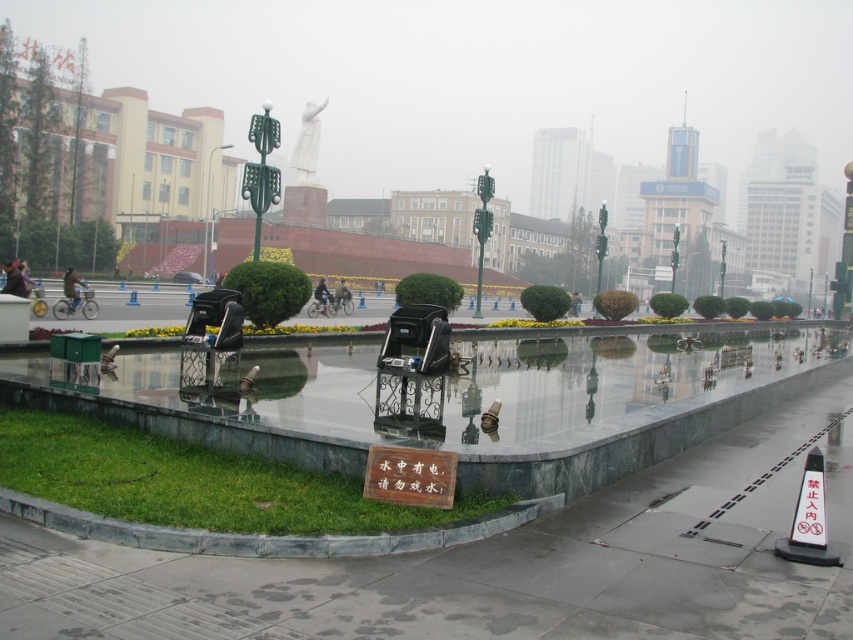
You are a delivery person with a 1.5 meter wide cart. You need to move from the marble pavement at center to the dark blue jacket at left. Is there enough space for your cart to pass through the area between them?

The marble pavement at center and dark blue jacket at left are 24.13 meters apart from each other, so yes, the cart can pass through the area between them since the distance is much wider than the cart.

You are a photographer planning to capture a shot of the green grass at lower left and the dark blue jacket at center. Which object should you focus on first if you want to ensure both are in sharp focus, considering their relative sizes in the frame?

The green grass at lower left is not as tall as the dark blue jacket at center, so you should focus on the dark blue jacket at center first since it is larger and more prominent in the frame.

You are standing at the edge of the plaza near the two black ornate chairs. You want to walk to the green grass at lower left and the dark blue jacket at center. Which object should you approach first if you walk straight ahead from your current position?

The dark blue jacket at center is to the left of the green grass at lower left, so you should approach the dark blue jacket at center first before reaching the green grass at lower left.